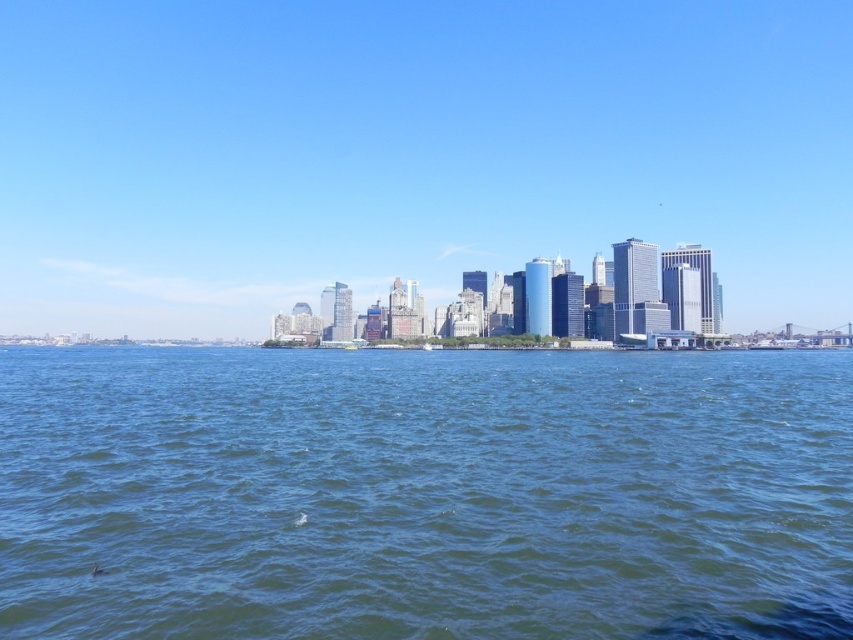
Can you confirm if blue glass skyscrapers at center is bigger than blue liquid water at center?

Correct, blue glass skyscrapers at center is larger in size than blue liquid water at center.

Looking at this image, does blue glass skyscrapers at center appear under blue liquid water at center?

Incorrect, blue glass skyscrapers at center is not positioned below blue liquid water at center.

Measure the distance between point (474, 216) and camera.

They are 661.64 feet apart.

The height and width of the screenshot is (640, 853). Find the location of `blue glass skyscrapers at center`. blue glass skyscrapers at center is located at coordinates (410, 152).